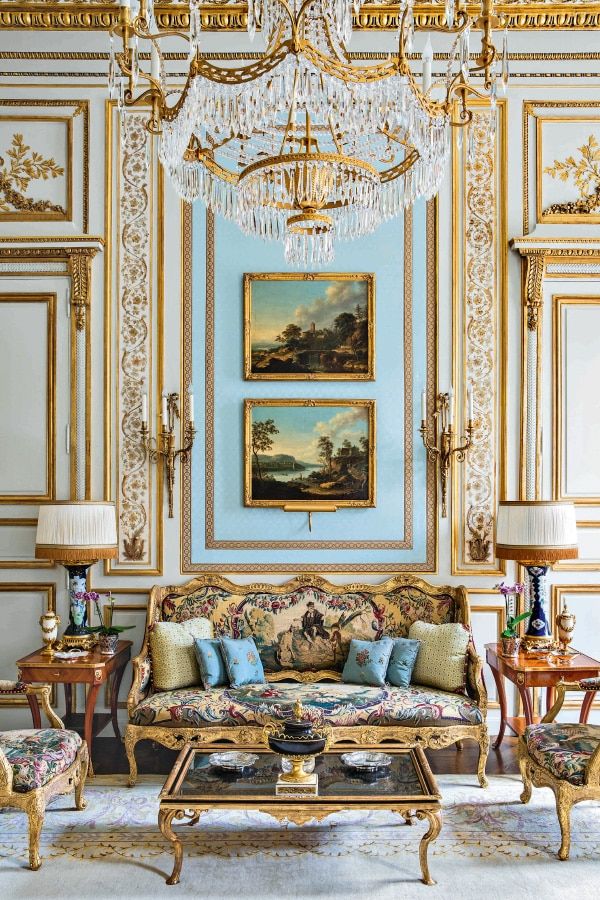
Identify the location of fake candles. (425, 408), (451, 407), (476, 407), (192, 410), (163, 411), (142, 410).